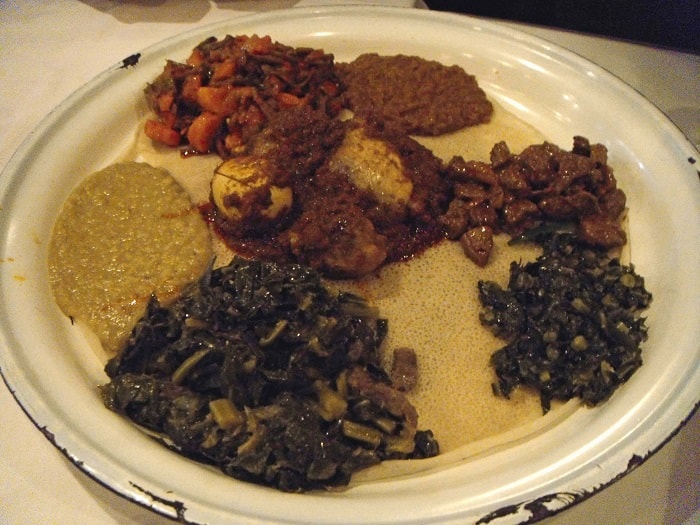
I want to click on ceramic plate, so (598, 127), (346, 519), (66, 158).